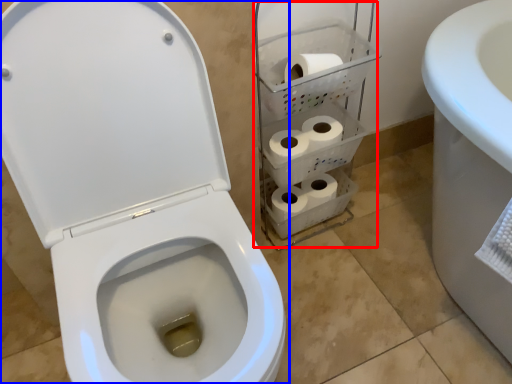
Question: Which object is closer to the camera taking this photo, shelf (highlighted by a red box) or toilet (highlighted by a blue box)?

Choices:
 (A) shelf
 (B) toilet

Answer: (B)